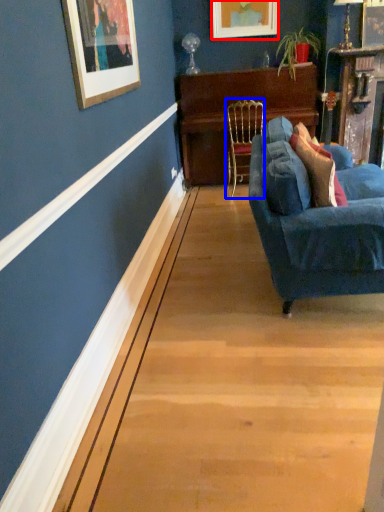
Question: Which object is closer to the camera taking this photo, picture frame (highlighted by a red box) or chair (highlighted by a blue box)?

Choices:
 (A) picture frame
 (B) chair

Answer: (B)